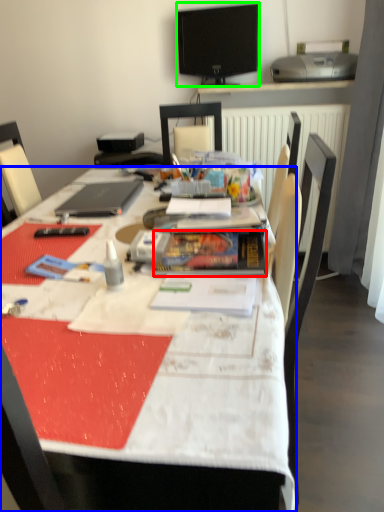
Question: Which object is the closest to the paperback book (highlighted by a red box)? Choose among these: desk (highlighted by a blue box) or television (highlighted by a green box).

Choices:
 (A) desk
 (B) television

Answer: (A)